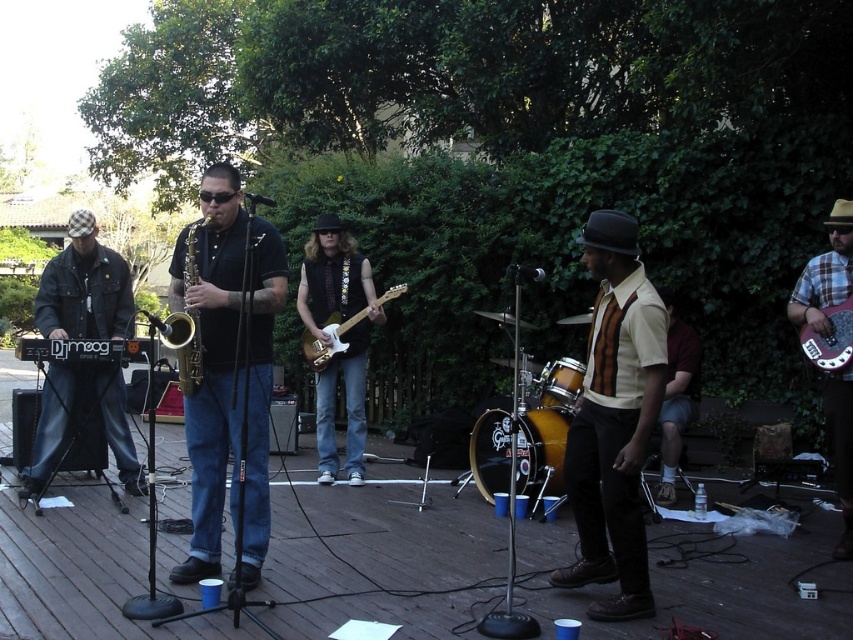
You are a stagehand who needs to place a protective cover over the shiny gold saxophone at center and the matte electric guitar at center during a quick set change. The cover has a width that can only accommodate instruments up to 12 inches thick. Which instrument will the cover fit over without issue?

The shiny gold saxophone at center is thinner than the matte electric guitar at center, so the cover will fit over the shiny gold saxophone at center without issue since it is thinner than 12 inches.

You are a photographer at the back of the stage trying to capture a clear shot of both the shiny gold saxophone at center and the shiny gold drum at center. Which one is positioned higher in the frame?

The shiny gold saxophone at center is above the shiny gold drum at center, so it is positioned higher in the frame.

You are a stagehand setting up a new microphone stand. You need to place it between the shiny gold saxophone at center and the shiny gold drum at center. Which side of the saxophone should you place it so it doesn

The shiny gold saxophone at center is wider than the shiny gold drum at center, so you should place the microphone stand on the side of the saxophone that faces away from the drum to accommodate its width.